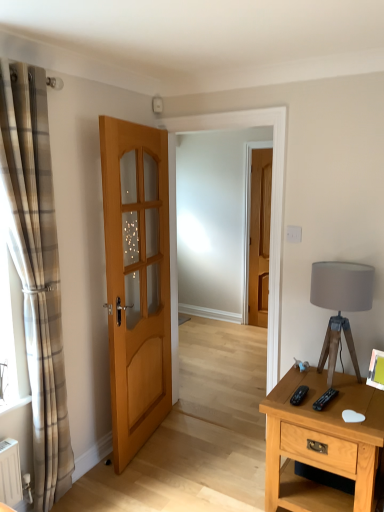
Question: Which direction should I rotate to face light brown wooden door at center, acting as the second door starting from the back, — up or down?

Choices:
 (A) up
 (B) down

Answer: (B)

Question: Is matte gray fabric lampshade at right directly adjacent to plaid fabric curtain at left?

Choices:
 (A) no
 (B) yes

Answer: (A)

Question: Considering the relative sizes of matte gray fabric lampshade at right and plaid fabric curtain at left in the image provided, is matte gray fabric lampshade at right bigger than plaid fabric curtain at left?

Choices:
 (A) no
 (B) yes

Answer: (A)

Question: Can you confirm if matte gray fabric lampshade at right is thinner than plaid fabric curtain at left?

Choices:
 (A) no
 (B) yes

Answer: (A)

Question: Does matte gray fabric lampshade at right come behind plaid fabric curtain at left?

Choices:
 (A) yes
 (B) no

Answer: (A)

Question: Can you confirm if matte gray fabric lampshade at right is positioned to the right of plaid fabric curtain at left?

Choices:
 (A) yes
 (B) no

Answer: (A)

Question: Considering the relative sizes of matte gray fabric lampshade at right and plaid fabric curtain at left in the image provided, is matte gray fabric lampshade at right smaller than plaid fabric curtain at left?

Choices:
 (A) no
 (B) yes

Answer: (B)

Question: Would you say matte gray fabric lampshade at right is a long distance from light brown wooden nightstand at right?

Choices:
 (A) no
 (B) yes

Answer: (A)

Question: Can you confirm if matte gray fabric lampshade at right is positioned to the right of light brown wooden nightstand at right?

Choices:
 (A) no
 (B) yes

Answer: (B)

Question: Is matte gray fabric lampshade at right further to camera compared to light brown wooden nightstand at right?

Choices:
 (A) no
 (B) yes

Answer: (B)

Question: Considering the relative sizes of matte gray fabric lampshade at right and light brown wooden nightstand at right in the image provided, is matte gray fabric lampshade at right wider than light brown wooden nightstand at right?

Choices:
 (A) yes
 (B) no

Answer: (B)

Question: Considering the relative sizes of matte gray fabric lampshade at right and light brown wooden nightstand at right in the image provided, is matte gray fabric lampshade at right shorter than light brown wooden nightstand at right?

Choices:
 (A) yes
 (B) no

Answer: (B)

Question: Is matte gray fabric lampshade at right surrounding light brown wooden nightstand at right?

Choices:
 (A) no
 (B) yes

Answer: (A)

Question: From a real-world perspective, is light brown wooden door at center, the 1th door viewed from the front, on top of matte wooden door at center, which ranks as the 2th door in front-to-back order?

Choices:
 (A) yes
 (B) no

Answer: (B)